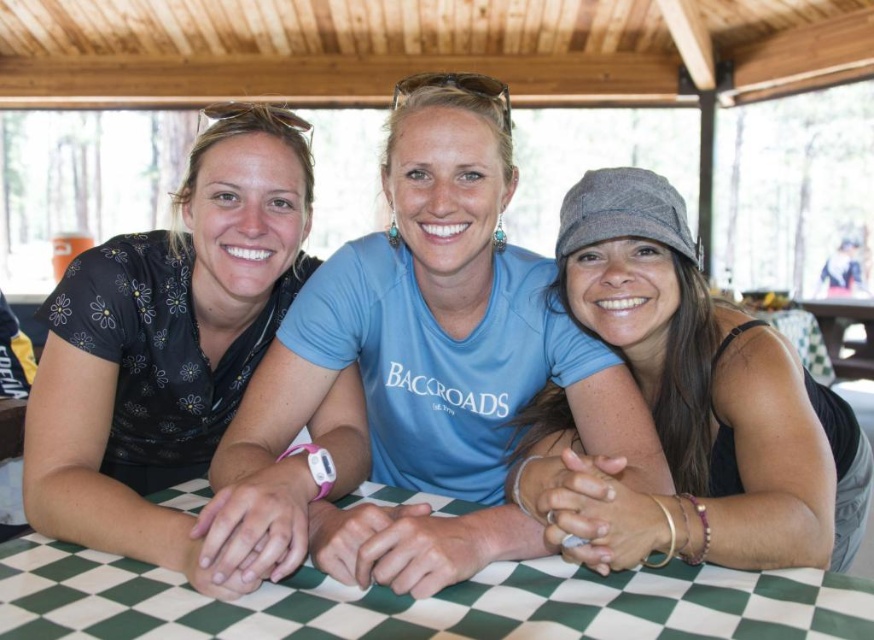
You are a photographer standing 10 feet away from the two people wearing the matte black shirt at center and the black floral shirt at left. You want to take a photo that includes both of them in the frame. Considering their distance apart, do you think you can fit both into the photo without moving closer or farther away?

The matte black shirt at center and the black floral shirt at left are 6.98 inches apart from each other. Since the photographer is 10 feet away, which is a sufficient distance to capture both individuals within the camera frame, they can be included in the photo without needing to adjust their positions or the camera distance.

You are planning to place a gray fabric cap at center on the green checkered table at center. Based on their sizes, will the cap fit entirely on the table?

The gray fabric cap at center has a width less than the green checkered table at center, so it will fit entirely on the table.

You are a photographer standing behind the three people at the table. You want to take a photo of the green checkered table at center without the gray fabric cap at center blocking the view. Is it possible to do so without moving any objects?

The gray fabric cap at center is much taller than the green checkered table at center, so it would block the view. Therefore, you cannot take a photo of the green checkered table at center without the gray fabric cap at center blocking the view without moving any objects.